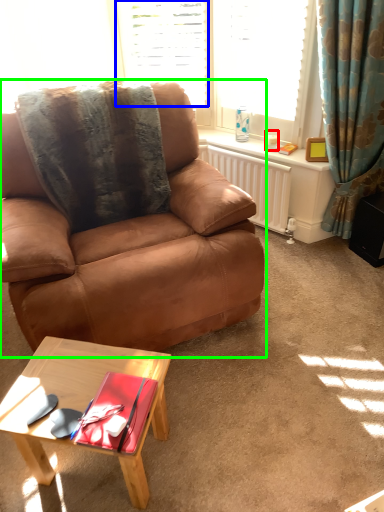
Question: Which is nearer to the coffee cup (highlighted by a red box)? window (highlighted by a blue box) or chair (highlighted by a green box).

Choices:
 (A) window
 (B) chair

Answer: (A)